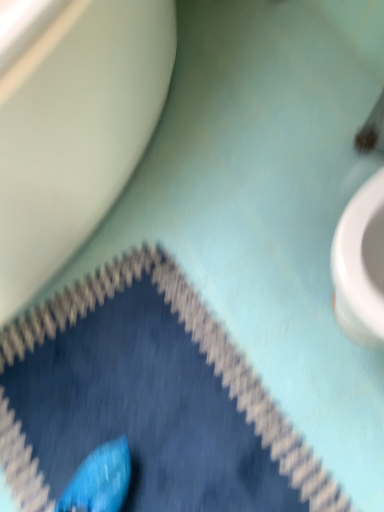
Question: Should I look upward or downward to see blue fabric bath mat at lower left?

Choices:
 (A) down
 (B) up

Answer: (A)